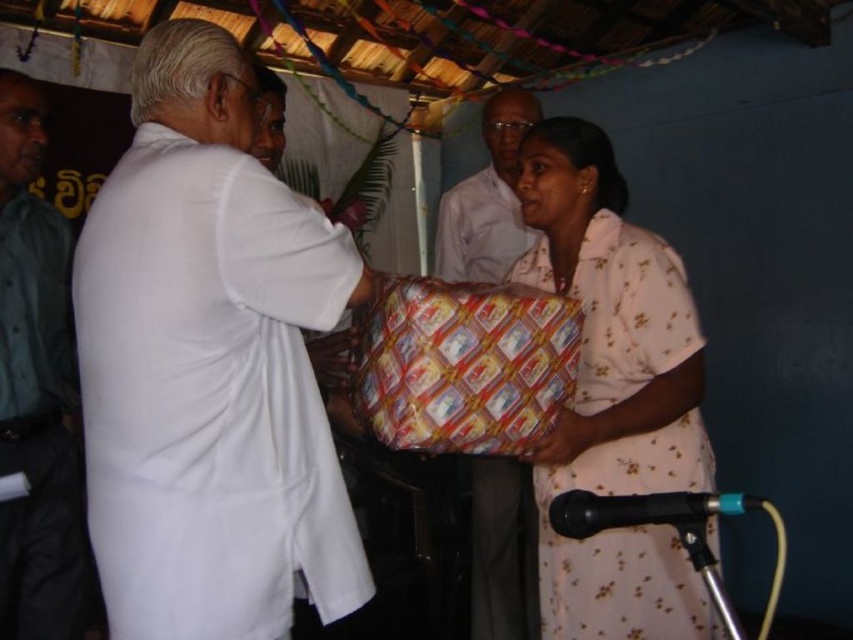
Which of these two, pink floral dress at center or matte white shirt at center, stands taller?

pink floral dress at center is taller.

Between pink floral dress at center and matte white shirt at center, which one appears on the right side from the viewer's perspective?

Positioned to the right is pink floral dress at center.

This screenshot has height=640, width=853. Identify the location of pink floral dress at center. (613, 394).

Locate an element on the screen. The height and width of the screenshot is (640, 853). pink floral dress at center is located at coordinates (613, 394).

Who is more forward, (x=192, y=481) or (x=624, y=312)?

Point (x=192, y=481) is in front.

Is white cloth shirt at center wider than pink floral dress at center?

Yes.

Identify the location of white cloth shirt at center. The height and width of the screenshot is (640, 853). (209, 365).

At what (x,y) coordinates should I click in order to perform the action: click on white cloth shirt at center. Please return your answer as a coordinate pair (x, y). This screenshot has height=640, width=853. Looking at the image, I should click on (209, 365).

Find the location of a particular element. white cloth shirt at center is located at coordinates (209, 365).

Looking at this image, can you confirm if white cloth shirt at center is positioned to the left of green uniform shirt at left?

Incorrect, white cloth shirt at center is not on the left side of green uniform shirt at left.

This screenshot has width=853, height=640. What do you see at coordinates (209, 365) in the screenshot?
I see `white cloth shirt at center` at bounding box center [209, 365].

The width and height of the screenshot is (853, 640). Identify the location of white cloth shirt at center. (209, 365).